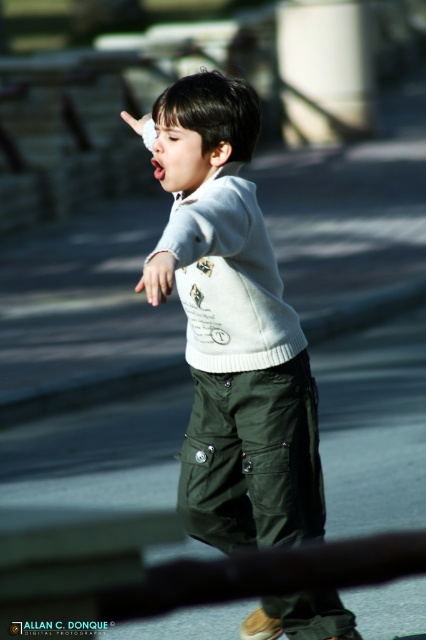
You are a photographer trying to capture the child in the image. You notice two sweaters on the child. Which sweater, the white matte sweater at center or the white knitted sweater at center, is located to the right side of the other?

The white matte sweater at center is positioned on the right side of the white knitted sweater at center.

You are a photographer trying to capture the child in the image. You want to ensure both the white matte sweater at center and the white matte hand at center are clearly visible in your shot. Based on their positions, which object should you focus on first to ensure both are in focus?

The white matte sweater at center is to the right of white matte hand at center, so focusing on the white matte hand at center first would ensure both are in focus since it is closer to the center of the image.

You are a photographer trying to capture a candid shot of the child. The camera you are using has a depth of field that can focus clearly on objects within 15 feet. Based on the scene, will the point at point (301, 632) be in focus?

The point at point (301, 632) is 18.10 feet from the camera, which is beyond the 15 feet depth of field limit. Therefore, it will not be in focus.